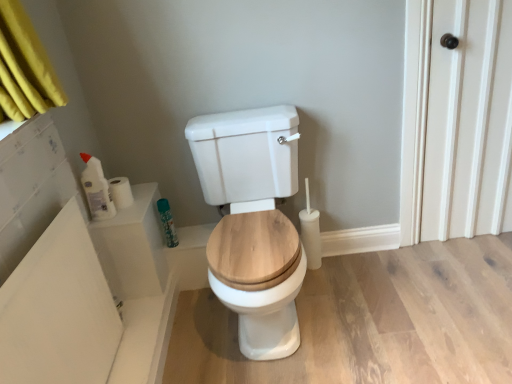
Describe the element at coordinates (120, 192) in the screenshot. This screenshot has width=512, height=384. I see `white matte toilet paper at upper left` at that location.

What do you see at coordinates (469, 122) in the screenshot?
I see `white wood door at right` at bounding box center [469, 122].

Locate an element on the screen. This screenshot has height=384, width=512. green matte spray can at upper left, which is counted as the first toiletry, starting from the back is located at coordinates (167, 223).

How much space does green matte spray can at upper left, which is counted as the first toiletry, starting from the back, occupy vertically?

green matte spray can at upper left, which is counted as the first toiletry, starting from the back, is 9.35 inches tall.

Describe the element at coordinates (253, 222) in the screenshot. This screenshot has height=384, width=512. I see `white glossy toilet at center` at that location.

Find the location of a particular element. The height and width of the screenshot is (384, 512). white glossy bottle at left, the second toiletry in the right-to-left sequence is located at coordinates (96, 189).

Is white glossy bathtub at upper left aimed at white glossy bottle at left, acting as the 1th toiletry starting from the left?

No, white glossy bathtub at upper left does not turn towards white glossy bottle at left, acting as the 1th toiletry starting from the left.

From a real-world perspective, relative to white glossy bottle at left, the second toiletry in the right-to-left sequence, is white glossy bathtub at upper left vertically above or below?

white glossy bathtub at upper left is situated lower than white glossy bottle at left, the second toiletry in the right-to-left sequence, in the real world.

Which is more to the right, white glossy bathtub at upper left or white glossy bottle at left, the 2th toiletry from the back?

white glossy bathtub at upper left is more to the right.

Measure the distance between white glossy bathtub at upper left and white glossy bottle at left, the second toiletry in the right-to-left sequence.

white glossy bathtub at upper left and white glossy bottle at left, the second toiletry in the right-to-left sequence, are 35.27 centimeters apart from each other.

Is white wood door at right surrounding white glossy bottle at left, acting as the 1th toiletry starting from the left?

No, white glossy bottle at left, acting as the 1th toiletry starting from the left, is not a part of white wood door at right.

From a real-world perspective, who is located higher, white wood door at right or white glossy bottle at left, the second toiletry in the right-to-left sequence?

white glossy bottle at left, the second toiletry in the right-to-left sequence, is physically above.

Which object is thinner, white wood door at right or white glossy bottle at left, acting as the 1th toiletry starting from the left?

With smaller width is white glossy bottle at left, acting as the 1th toiletry starting from the left.

Is the position of white wood door at right more distant than that of white glossy bottle at left, the second toiletry in the right-to-left sequence?

Yes, white wood door at right is further from the viewer.

Is the position of white glossy bottle at left, acting as the 1th toiletry starting from the left, less distant than that of white matte toilet paper at upper left?

Yes, white glossy bottle at left, acting as the 1th toiletry starting from the left, is in front of white matte toilet paper at upper left.

Is white glossy bottle at left, which is counted as the 1th toiletry, starting from the front, not close to white matte toilet paper at upper left?

No, white glossy bottle at left, which is counted as the 1th toiletry, starting from the front, is not far from white matte toilet paper at upper left.

Would you say white glossy bottle at left, the 2th toiletry from the back, contains white matte toilet paper at upper left?

No, white matte toilet paper at upper left is not surrounded by white glossy bottle at left, the 2th toiletry from the back.

From the image's perspective, relative to white matte toilet paper at upper left, is white glossy bottle at left, which is counted as the 1th toiletry, starting from the front, above or below?

From the image's perspective, white glossy bottle at left, which is counted as the 1th toiletry, starting from the front, appears above white matte toilet paper at upper left.

Would you say white glossy bathtub at upper left contains white matte toilet paper at upper left?

No, white matte toilet paper at upper left is located outside of white glossy bathtub at upper left.

Based on the photo, is white glossy bathtub at upper left touching white matte toilet paper at upper left?

No, white glossy bathtub at upper left is not with white matte toilet paper at upper left.

Who is more distant, white glossy bathtub at upper left or white matte toilet paper at upper left?

Positioned behind is white matte toilet paper at upper left.

How many degrees apart are the facing directions of white glossy bathtub at upper left and white matte toilet paper at upper left?

The angle between the facing direction of white glossy bathtub at upper left and the facing direction of white matte toilet paper at upper left is 0.417 degrees.

Considering the positions of point (168, 211) and point (489, 126), is point (168, 211) closer or farther from the camera than point (489, 126)?

Point (168, 211) appears to be farther away from the viewer than point (489, 126).

Identify the location of screen door on the right of green matte spray can at upper left, arranged as the 1th toiletry when viewed from the right. This screenshot has width=512, height=384. (469, 122).

Consider the image. Based on their sizes in the image, would you say green matte spray can at upper left, the 2th toiletry when ordered from front to back, is bigger or smaller than white wood door at right?

green matte spray can at upper left, the 2th toiletry when ordered from front to back, is smaller than white wood door at right.

Is green matte spray can at upper left, the 2th toiletry from the left, inside or outside of white wood door at right?

green matte spray can at upper left, the 2th toiletry from the left, lies outside white wood door at right.

From their relative heights in the image, would you say white wood door at right is taller or shorter than green matte spray can at upper left, which is counted as the first toiletry, starting from the back?

Considering their sizes, white wood door at right has more height than green matte spray can at upper left, which is counted as the first toiletry, starting from the back.

Looking at this image, is white wood door at right completely or partially outside of green matte spray can at upper left, the 2th toiletry when ordered from front to back?

white wood door at right is positioned outside green matte spray can at upper left, the 2th toiletry when ordered from front to back.

From a real-world perspective, is white wood door at right over green matte spray can at upper left, the 2th toiletry from the left?

Yes, from a real-world perspective, white wood door at right is over green matte spray can at upper left, the 2th toiletry from the left

From the image's perspective, between white glossy bathtub at upper left and white glossy toilet at center, which one is located above?

From the image's view, white glossy toilet at center is above.

Looking at this image, is white glossy toilet at center at the back of white glossy bathtub at upper left?

No, white glossy bathtub at upper left is not facing away from white glossy toilet at center.

Can we say white glossy bathtub at upper left lies outside white glossy toilet at center?

white glossy bathtub at upper left lies outside white glossy toilet at center's area.

Is point (85, 340) positioned before point (297, 164)?

Yes, point (85, 340) is closer to viewer.

Where is `toiletry that is on the left side of white glossy bathtub at upper left`? toiletry that is on the left side of white glossy bathtub at upper left is located at coordinates (96, 189).

Where is `toiletry in front of the white wood door at right`? The image size is (512, 384). toiletry in front of the white wood door at right is located at coordinates (96, 189).

When comparing their distances from white wood door at right, does white glossy bottle at left, acting as the 1th toiletry starting from the left, or white matte toilet paper at upper left seem closer?

The object closer to white wood door at right is white matte toilet paper at upper left.

Estimate the real-world distances between objects in this image. Which object is further from green matte spray can at upper left, which is counted as the first toiletry, starting from the back, white wood door at right or white glossy toilet at center?

white wood door at right is positioned further to the anchor green matte spray can at upper left, which is counted as the first toiletry, starting from the back.

Estimate the real-world distances between objects in this image. Which object is closer to white glossy bathtub at upper left, white wood door at right or white glossy bottle at left, which is counted as the 1th toiletry, starting from the front?

white glossy bottle at left, which is counted as the 1th toiletry, starting from the front, is closer to white glossy bathtub at upper left.

When comparing their distances from white glossy toilet at center, does white matte toilet paper at upper left or white glossy bathtub at upper left seem further?

Based on the image, white matte toilet paper at upper left appears to be further to white glossy toilet at center.

From the image, which object appears to be nearer to white glossy toilet at center, white glossy bottle at left, acting as the 1th toiletry starting from the left, or white glossy bathtub at upper left?

The object closer to white glossy toilet at center is white glossy bathtub at upper left.

When comparing their distances from white matte toilet paper at upper left, does white glossy bottle at left, the 2th toiletry from the back, or white glossy toilet at center seem further?

white glossy toilet at center lies further to white matte toilet paper at upper left than the other object.

Based on their spatial positions, is white glossy toilet at center or white glossy bathtub at upper left closer to white matte toilet paper at upper left?

Among the two, white glossy bathtub at upper left is located nearer to white matte toilet paper at upper left.

Looking at the image, which one is located closer to white glossy bathtub at upper left, green matte spray can at upper left, arranged as the 1th toiletry when viewed from the right, or white glossy bottle at left, acting as the 1th toiletry starting from the left?

white glossy bottle at left, acting as the 1th toiletry starting from the left.

Locate an element on the screen. This screenshot has height=384, width=512. toiletry between white glossy bathtub at upper left and white wood door at right in the horizontal direction is located at coordinates (167, 223).

The image size is (512, 384). I want to click on toiletry between white glossy toilet at center and green matte spray can at upper left, the 2th toiletry when ordered from front to back, along the z-axis, so click(96, 189).

At what (x,y) coordinates should I click in order to perform the action: click on porcelain located between white matte toilet paper at upper left and white wood door at right in the left-right direction. Please return your answer as a coordinate pair (x, y). This screenshot has width=512, height=384. Looking at the image, I should click on (253, 222).

The width and height of the screenshot is (512, 384). Find the location of `toilet paper situated between white glossy bottle at left, the 2th toiletry from the back, and white glossy toilet at center from left to right`. toilet paper situated between white glossy bottle at left, the 2th toiletry from the back, and white glossy toilet at center from left to right is located at coordinates (120, 192).